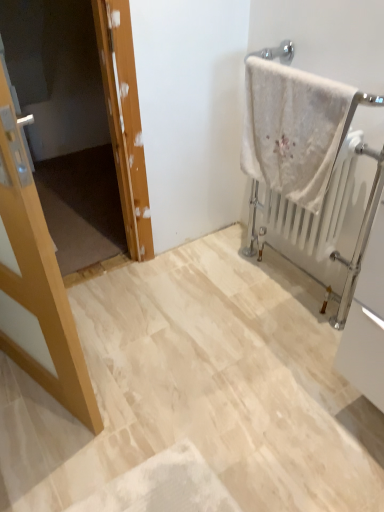
This screenshot has width=384, height=512. In order to click on free spot in front of light wood door at left in this screenshot , I will do pyautogui.click(x=40, y=444).